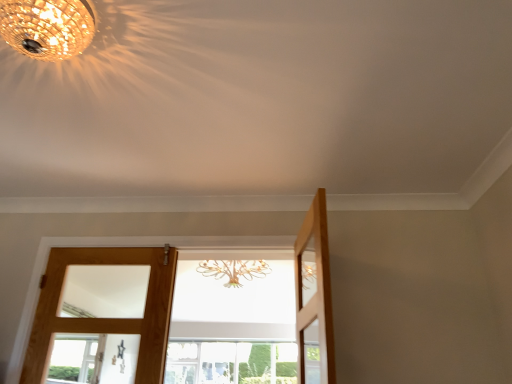
Question: Looking at their shapes, would you say clear glass window at center is wider or thinner than crystal chandelier at upper left?

Choices:
 (A) thin
 (B) wide

Answer: (B)

Question: Relative to crystal chandelier at upper left, is clear glass window at center in front or behind?

Choices:
 (A) behind
 (B) front

Answer: (A)

Question: Estimate the real-world distances between objects in this image. Which object is closer to the wooden door at center, acting as the second door starting from the right?

Choices:
 (A) clear glass window at center
 (B) crystal chandelier at upper left
 (C) light brown wooden door at right, positioned as the 3th door in left-to-right order
 (D) light brown wooden door at left, the third door when ordered from right to left

Answer: (D)

Question: Estimate the real-world distances between objects in this image. Which object is farther from the clear glass window at center?

Choices:
 (A) crystal chandelier at upper left
 (B) wooden door at center, the second door in the left-to-right sequence
 (C) light brown wooden door at left, the third door when ordered from right to left
 (D) light brown wooden door at right, the 1th door when ordered from right to left

Answer: (A)